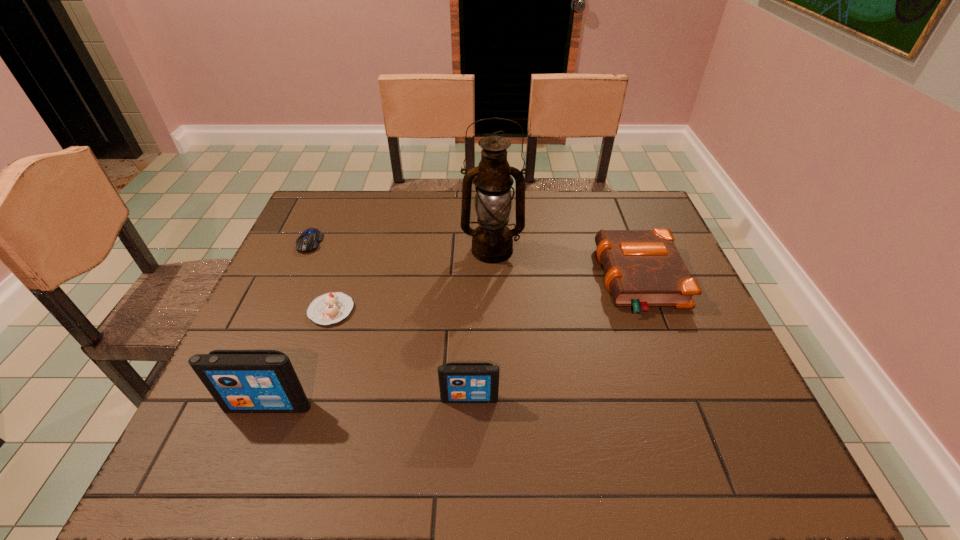
Locate an element on the screen. The height and width of the screenshot is (540, 960). object situated at the far left corner is located at coordinates (308, 241).

Locate an element on the screen. object located at the near left corner is located at coordinates (241, 381).

Image resolution: width=960 pixels, height=540 pixels. I want to click on vacant space at the far edge, so click(540, 205).

Locate an element on the screen. vacant space at the near edge of the desktop is located at coordinates (376, 395).

In the image, there is a desktop. At what (x,y) coordinates should I click in order to perform the action: click on free region at the left edge. Please return your answer as a coordinate pair (x, y). Looking at the image, I should click on (324, 288).

The height and width of the screenshot is (540, 960). I want to click on vacant area at the right edge of the desktop, so click(663, 316).

Locate an element on the screen. vacant space at the far left corner of the desktop is located at coordinates (341, 198).

Locate an element on the screen. free space between the fourth shortest object and the Bible is located at coordinates (554, 339).

The width and height of the screenshot is (960, 540). I want to click on free spot between the right iPod and the rightmost object, so click(554, 339).

I want to click on free space between the shorter iPod and the taller iPod, so pos(369,402).